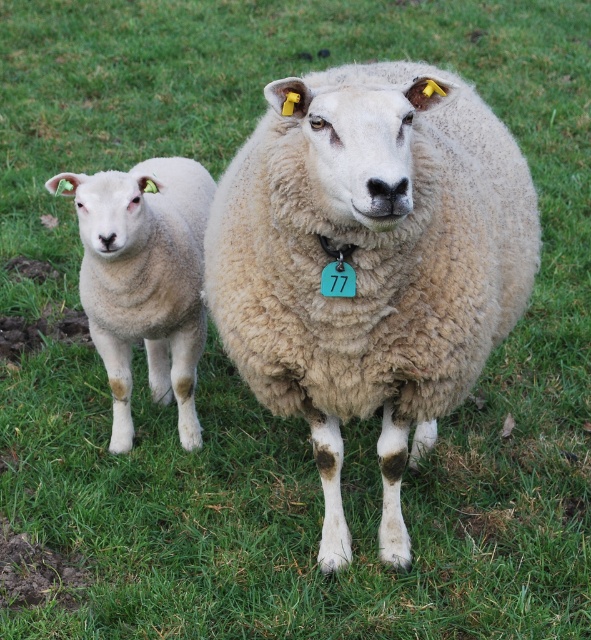
You are a farmer trying to fit both the fuzzy beige sheep at center and the white woolen lamb at left into a narrow sheep pen that can only accommodate one sheep at a time. Based on their sizes, which sheep should you prioritize moving first?

The fuzzy beige sheep at center is wider than the white woolen lamb at left, so you should prioritize moving the white woolen lamb at left first to ensure it can fit through the narrow sheep pen before the larger sheep.

You are a farmer standing in the field and want to approach the fuzzy beige sheep at center. Given that the sheep is 1.74 meters away from you, can you reach it with a 2.5 meter long rope?

The fuzzy beige sheep at center is 1.74 meters away from the viewer. Since the rope is 2.5 meters long, which is longer than the distance, you can reach the fuzzy beige sheep at center with the rope.

You are a farmer checking the sheep in your field. You see the fuzzy beige sheep at center and the white woolen lamb at left. Which sheep is positioned further to the east?

The white woolen lamb at left is positioned further to the east because the fuzzy beige sheep at center is to the right of white woolen lamb at left, meaning the lamb is on the left side facing east.